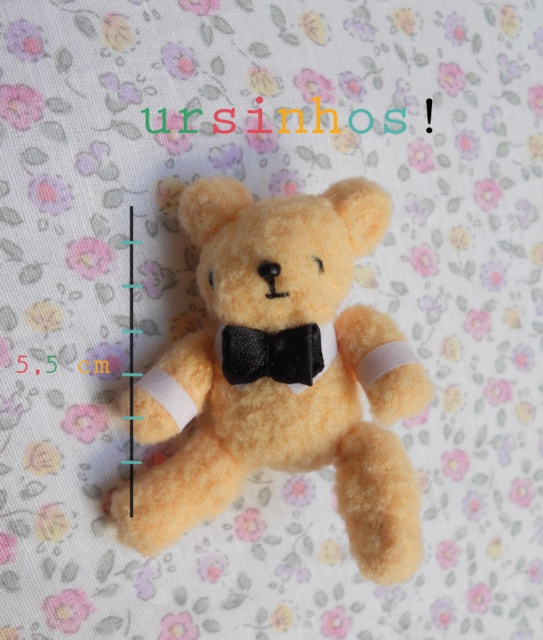
In the scene shown: You are a toy designer examining the image of a fuzzy yellow teddy bear at center and a black satin bow tie at center. Which object is located to the right of the other?

The fuzzy yellow teddy bear at center is positioned on the left side of black satin bow tie at center, so the black satin bow tie at center is to the right of the fuzzy yellow teddy bear at center.

Based on the photo, you are a photographer setting up a shoot with the fuzzy yellow teddy bear at center and the black satin bow tie at center. You want to ensure the bow tie is visible in the final photo. Based on their positions, should you adjust the camera angle to look upward or downward?

The fuzzy yellow teddy bear at center is located below the black satin bow tie at center. To ensure the bow tie is visible, you should adjust the camera angle to look upward so that the teddy bear doesn

You are a toy designer who wants to create a miniature version of the teddy bear. The miniature must fit in a 4 inch tall display case. Considering the distance between the fuzzy yellow teddy bear at center and the black satin bow tie at center, will the current spacing between them allow the miniature to fit without overlapping?

The distance between the fuzzy yellow teddy bear at center and the black satin bow tie at center is 4.68 inches. Since the display case is only 4 inches tall, the miniature would require scaling down this distance to 4 inches or less. However, maintaining the original spacing would result in an overlap because 4.68 inches exceeds the 4 inch limit. Therefore, adjustments are needed to reduce the spacing between them for the miniature to fit without overlapping.